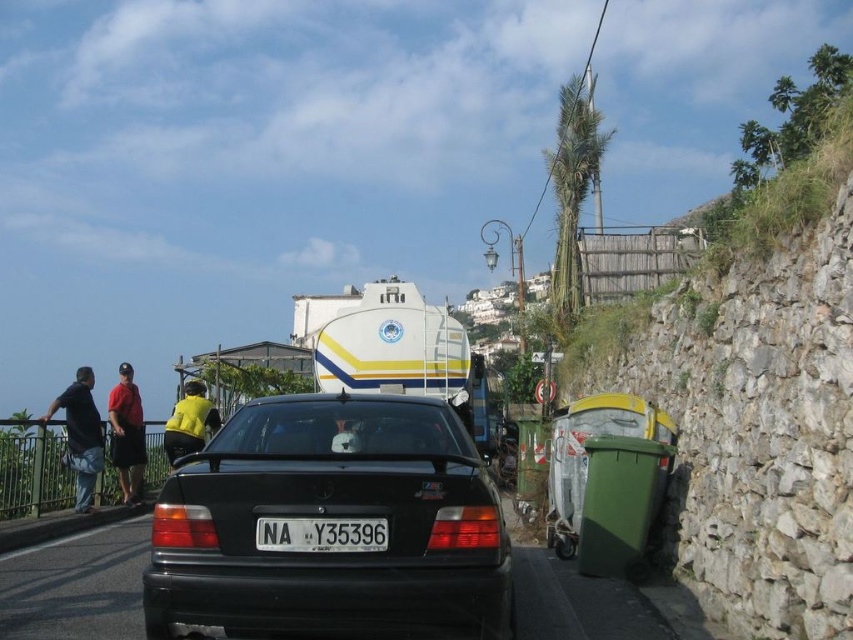
Question: From the image, what is the correct spatial relationship of black matte car at center in relation to dark blue jeans at left?

Choices:
 (A) left
 (B) right

Answer: (B)

Question: Where is white plastic license plate at center located in relation to matte red shirt at left in the image?

Choices:
 (A) below
 (B) above

Answer: (B)

Question: Which of the following is the closest to the observer?

Choices:
 (A) white plastic license plate at center
 (B) yellow fabric shirt at upper center
 (C) matte red shirt at left

Answer: (A)

Question: Considering the relative positions of black matte car at center and white plastic license plate at center in the image provided, where is black matte car at center located with respect to white plastic license plate at center?

Choices:
 (A) below
 (B) above

Answer: (B)

Question: Which of the following is the farthest from the observer?

Choices:
 (A) dark blue jeans at left
 (B) matte red shirt at left

Answer: (B)

Question: Which object appears farthest from the camera in this image?

Choices:
 (A) yellow fabric shirt at upper center
 (B) black matte car at center

Answer: (A)